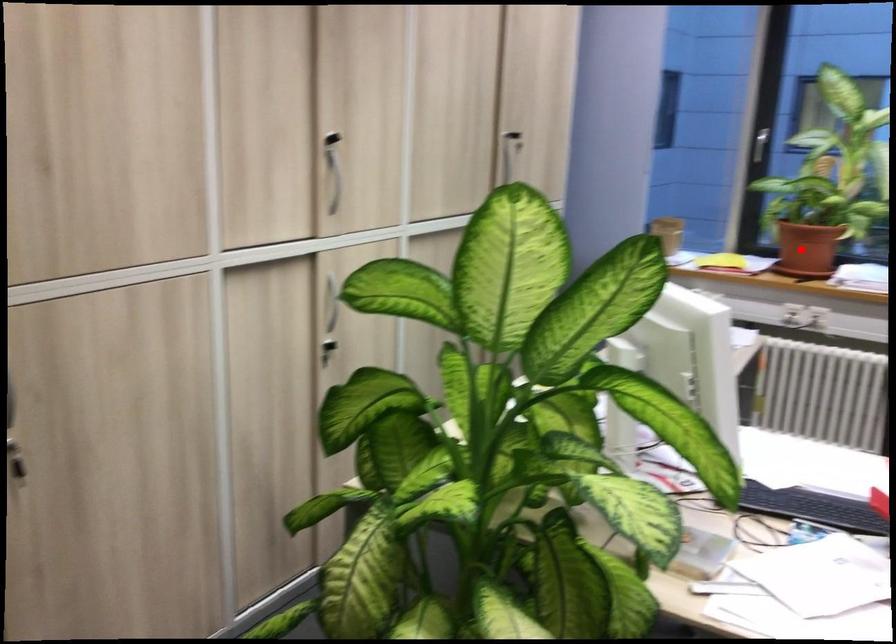
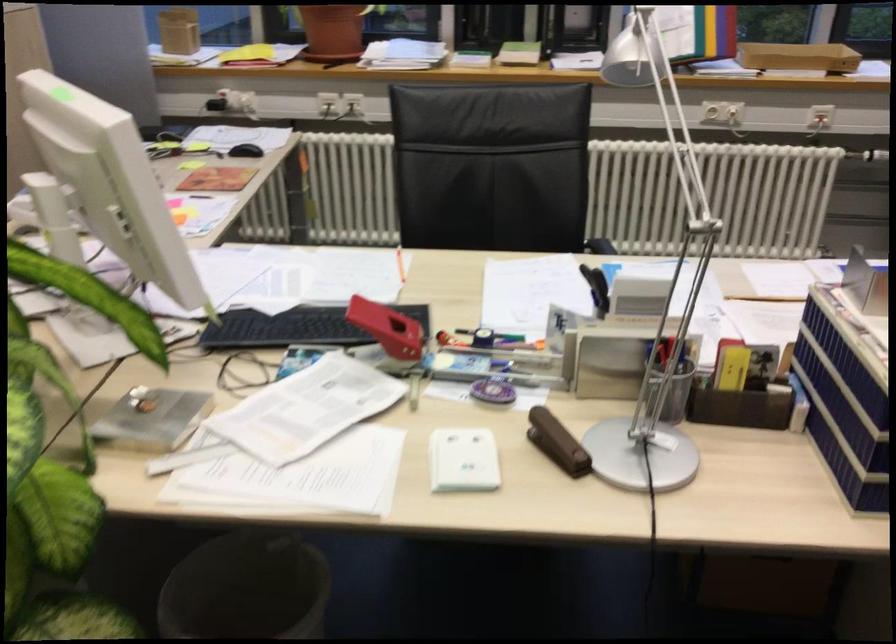
Where in the second image is the point corresponding to the highlighted location from the first image?

(332, 31)